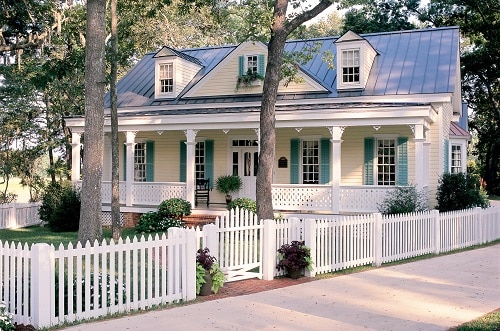
Image resolution: width=500 pixels, height=331 pixels. I want to click on planters, so [x=207, y=279], [x=296, y=269], [x=228, y=199].